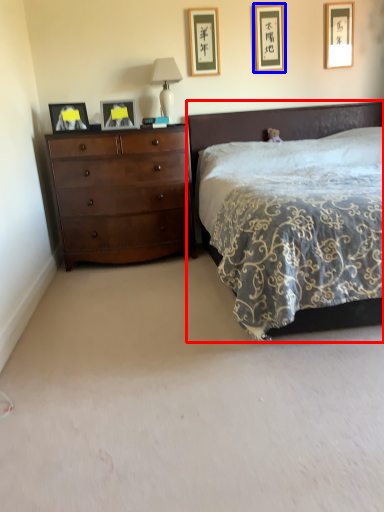
Question: Which object appears farthest to the camera in this image, bed (highlighted by a red box) or picture frame (highlighted by a blue box)?

Choices:
 (A) bed
 (B) picture frame

Answer: (B)